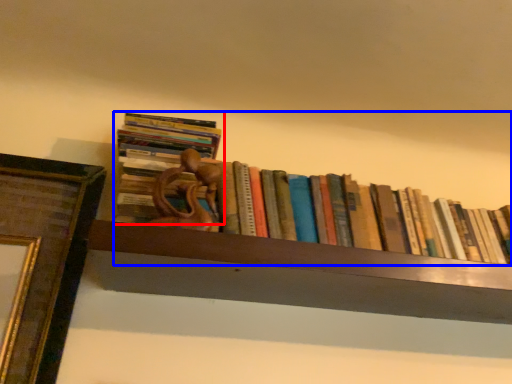
Question: Which point is further to the camera, book (highlighted by a red box) or book (highlighted by a blue box)?

Choices:
 (A) book
 (B) book

Answer: (B)